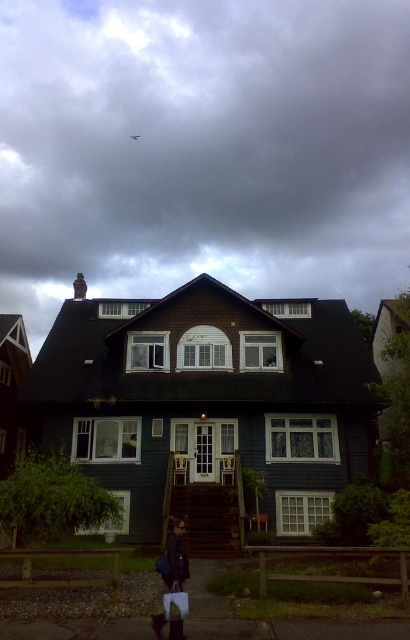
Does dark wood house at center have a lesser width compared to metallic gray plane at upper center?

No.

Is point (207, 474) positioned after point (131, 136)?

That is False.

Is point (353, 477) more distant than point (131, 138)?

No, it is in front of (131, 138).

Where is `dark wood house at center`? The image size is (410, 640). dark wood house at center is located at coordinates (207, 397).

Where is `dark gray cloud at upper center`? This screenshot has width=410, height=640. dark gray cloud at upper center is located at coordinates pos(202,148).

Describe the element at coordinates (202, 148) in the screenshot. I see `dark gray cloud at upper center` at that location.

At what (x,y) coordinates should I click in order to perform the action: click on dark gray cloud at upper center. Please return your answer as a coordinate pair (x, y). Looking at the image, I should click on (202, 148).

Can you confirm if dark blue fabric bag at lower center is thinner than metallic gray plane at upper center?

Yes.

Who is positioned more to the right, dark blue fabric bag at lower center or metallic gray plane at upper center?

dark blue fabric bag at lower center is more to the right.

This screenshot has width=410, height=640. What do you see at coordinates (173, 557) in the screenshot? I see `dark blue fabric bag at lower center` at bounding box center [173, 557].

This screenshot has height=640, width=410. I want to click on dark blue fabric bag at lower center, so click(173, 557).